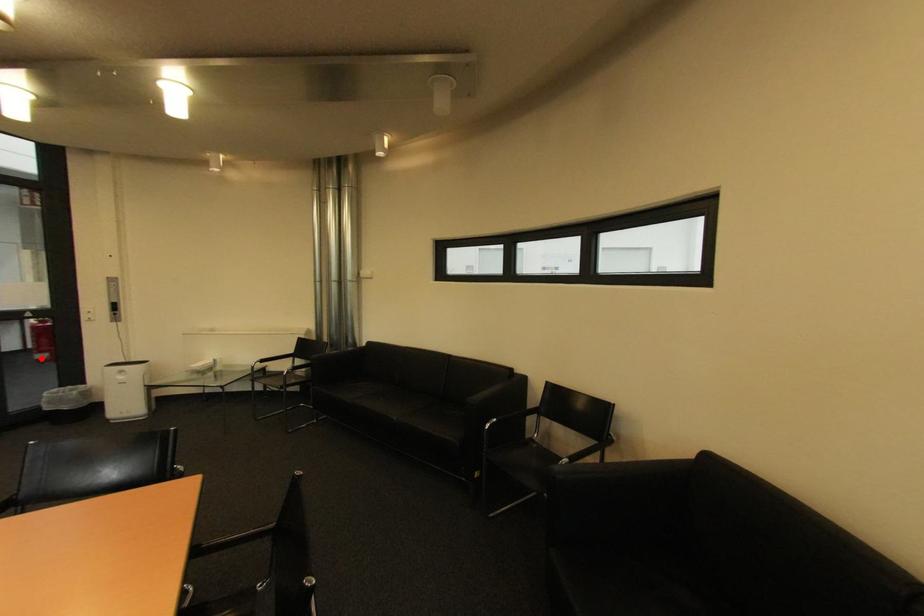
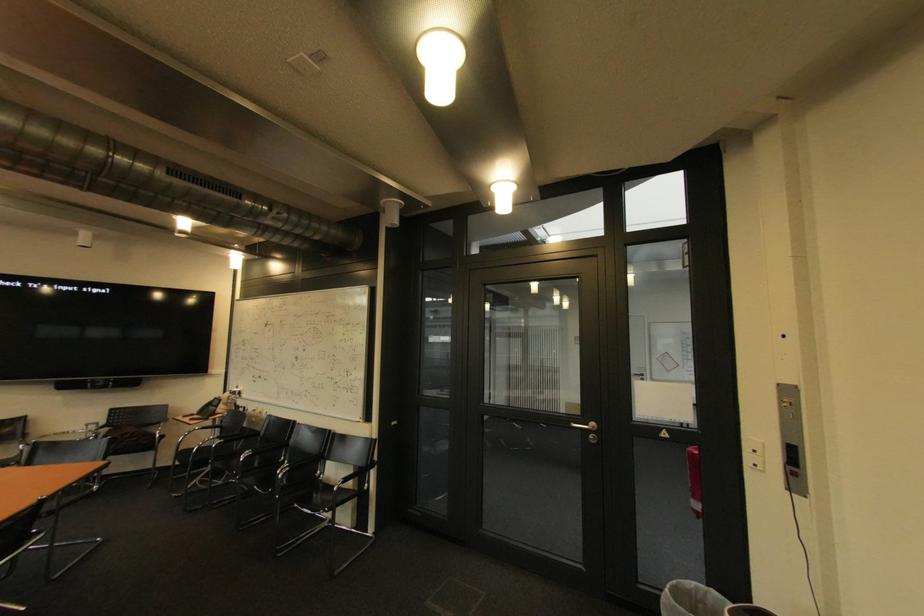
Question: I am providing you with two images of the same scene from different viewpoints. Given a red point in image1, look at the same physical point in image2. Is it:

Choices:
 (A) Closer to the viewpoint
 (B) Farther from the viewpoint

Answer: (B)